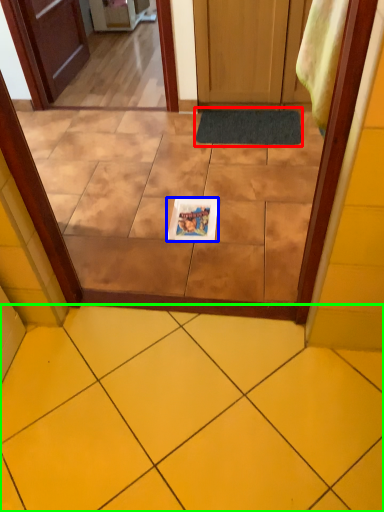
Question: Estimate the real-world distances between objects in this image. Which object is farther from doormat (highlighted by a red box), magazine (highlighted by a blue box) or ceramic tile (highlighted by a green box)?

Choices:
 (A) magazine
 (B) ceramic tile

Answer: (B)